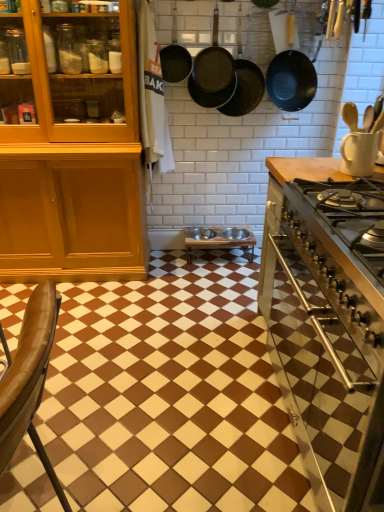
What do you see at coordinates (175, 56) in the screenshot? Image resolution: width=384 pixels, height=512 pixels. I see `matte black frying pan at upper center, arranged as the first frying pan when viewed from the left` at bounding box center [175, 56].

What is the approximate width of black matte frying pan at upper center, which is the first frying pan in right-to-left order?

black matte frying pan at upper center, which is the first frying pan in right-to-left order, is 7.88 inches in width.

I want to click on brown glossy tile at center, so click(x=169, y=394).

You are a GUI agent. You are given a task and a screenshot of the screen. Output one action in this format:
    pyautogui.click(x=<x>, y=<y>)
    Task: Click on the dark brown matte frying pan at upper center, acting as the 3th frying pan starting from the left
    The image size is (384, 512).
    Given the screenshot: What is the action you would take?
    pyautogui.click(x=245, y=89)

Locate an element on the screen. black cast iron frying pan at upper center, which appears as the 3th frying pan when viewed from the right is located at coordinates (213, 73).

Are dark brown matte frying pan at upper center, acting as the 3th frying pan starting from the left, and brown leather chair at lower left located far from each other?

Yes.

Is dark brown matte frying pan at upper center, acting as the 3th frying pan starting from the left, turned away from brown leather chair at lower left?

No, brown leather chair at lower left is not at the back of dark brown matte frying pan at upper center, acting as the 3th frying pan starting from the left.

From the image's perspective, who appears lower, dark brown matte frying pan at upper center, which is the second frying pan in right-to-left order, or brown leather chair at lower left?

From the image's view, brown leather chair at lower left is below.

Which point is more distant from viewer, [252,86] or [25,380]?

Positioned behind is point [252,86].

Considering the sizes of objects black cast iron frying pan at upper center, the 2th frying pan viewed from the left, and wooden table at center in the image provided, who is wider, black cast iron frying pan at upper center, the 2th frying pan viewed from the left, or wooden table at center?

With larger width is wooden table at center.

Looking at this image, from a real-world perspective, relative to wooden table at center, is black cast iron frying pan at upper center, which appears as the 3th frying pan when viewed from the right, vertically above or below?

black cast iron frying pan at upper center, which appears as the 3th frying pan when viewed from the right, is situated higher than wooden table at center in the real world.

Is black cast iron frying pan at upper center, which appears as the 3th frying pan when viewed from the right, positioned before wooden table at center?

Yes, the depth of black cast iron frying pan at upper center, which appears as the 3th frying pan when viewed from the right, is less than that of wooden table at center.

You are a GUI agent. You are given a task and a screenshot of the screen. Output one action in this format:
    pyautogui.click(x=<x>, y=<y>)
    Task: Click on the table on the right of black cast iron frying pan at upper center, the 2th frying pan viewed from the left
    This screenshot has width=384, height=512.
    Given the screenshot: What is the action you would take?
    pyautogui.click(x=220, y=239)

Which frying pan is the 4th one when counting from the back of the white matte mug at upper right? Please provide its 2D coordinates.

[(175, 56)]

Is white matte mug at upper right next to matte black frying pan at upper center, which ranks as the fourth frying pan in right-to-left order, and touching it?

No.

Between white matte mug at upper right and matte black frying pan at upper center, arranged as the first frying pan when viewed from the left, which one has larger size?

Bigger between the two is matte black frying pan at upper center, arranged as the first frying pan when viewed from the left.

Could you tell me if white matte mug at upper right is facing matte black frying pan at upper center, arranged as the first frying pan when viewed from the left?

No, white matte mug at upper right does not turn towards matte black frying pan at upper center, arranged as the first frying pan when viewed from the left.

Does point (351, 170) come in front of point (33, 332)?

No, it is behind (33, 332).

Would you say white matte mug at upper right is outside brown leather chair at lower left?

That's correct, white matte mug at upper right is outside of brown leather chair at lower left.

From the picture: Does white matte mug at upper right have a smaller size compared to brown leather chair at lower left?

Indeed, white matte mug at upper right has a smaller size compared to brown leather chair at lower left.

From the image's perspective, between black cast iron frying pan at upper center, which appears as the 3th frying pan when viewed from the right, and white matte mug at upper right, who is located below?

From the image's view, white matte mug at upper right is below.

Does black cast iron frying pan at upper center, which appears as the 3th frying pan when viewed from the right, have a greater height compared to white matte mug at upper right?

Yes.

In the scene shown: Is black cast iron frying pan at upper center, the 2th frying pan viewed from the left, to the left of white matte mug at upper right from the viewer's perspective?

Indeed, black cast iron frying pan at upper center, the 2th frying pan viewed from the left, is positioned on the left side of white matte mug at upper right.

Is white matte mug at upper right surrounded by black cast iron frying pan at upper center, the 2th frying pan viewed from the left?

No, white matte mug at upper right is not a part of black cast iron frying pan at upper center, the 2th frying pan viewed from the left.

Can you see matte black frying pan at upper center, arranged as the first frying pan when viewed from the left, touching black cast iron frying pan at upper center, which appears as the 3th frying pan when viewed from the right?

No, matte black frying pan at upper center, arranged as the first frying pan when viewed from the left, is not in contact with black cast iron frying pan at upper center, which appears as the 3th frying pan when viewed from the right.

Relative to black cast iron frying pan at upper center, the 2th frying pan viewed from the left, is matte black frying pan at upper center, which ranks as the fourth frying pan in right-to-left order, in front or behind?

matte black frying pan at upper center, which ranks as the fourth frying pan in right-to-left order, is behind black cast iron frying pan at upper center, the 2th frying pan viewed from the left.

Based on the photo, considering the positions of objects matte black frying pan at upper center, arranged as the first frying pan when viewed from the left, and black cast iron frying pan at upper center, which appears as the 3th frying pan when viewed from the right, in the image provided, who is more to the right, matte black frying pan at upper center, arranged as the first frying pan when viewed from the left, or black cast iron frying pan at upper center, which appears as the 3th frying pan when viewed from the right,?

From the viewer's perspective, black cast iron frying pan at upper center, which appears as the 3th frying pan when viewed from the right, appears more on the right side.

Could you tell me if matte black frying pan at upper center, arranged as the first frying pan when viewed from the left, is facing black cast iron frying pan at upper center, which appears as the 3th frying pan when viewed from the right?

No, matte black frying pan at upper center, arranged as the first frying pan when viewed from the left, is not facing towards black cast iron frying pan at upper center, which appears as the 3th frying pan when viewed from the right.

Could you tell me if metallic stainless steel stove at right is turned towards dark brown matte frying pan at upper center, which is the second frying pan in right-to-left order?

No, metallic stainless steel stove at right is not aimed at dark brown matte frying pan at upper center, which is the second frying pan in right-to-left order.

Which object is positioned more to the right, metallic stainless steel stove at right or dark brown matte frying pan at upper center, which is the second frying pan in right-to-left order?

metallic stainless steel stove at right is more to the right.

Based on the photo, is metallic stainless steel stove at right directly adjacent to dark brown matte frying pan at upper center, which is the second frying pan in right-to-left order?

No, metallic stainless steel stove at right is not in contact with dark brown matte frying pan at upper center, which is the second frying pan in right-to-left order.

Is metallic stainless steel stove at right shorter than dark brown matte frying pan at upper center, which is the second frying pan in right-to-left order?

No.

What are the coordinates of `the 1st frying pan behind when counting from the brown leather chair at lower left` in the screenshot? It's located at (245, 89).

Locate an element on the screen. The width and height of the screenshot is (384, 512). table that appears below the black cast iron frying pan at upper center, which appears as the 3th frying pan when viewed from the right (from the image's perspective) is located at coordinates (220, 239).

When comparing their distances from dark brown matte frying pan at upper center, acting as the 3th frying pan starting from the left, does brown glossy tile at center or metallic stainless steel stove at right seem further?

Among the two, brown glossy tile at center is located further to dark brown matte frying pan at upper center, acting as the 3th frying pan starting from the left.

From the image, which object appears to be nearer to black cast iron frying pan at upper center, the 2th frying pan viewed from the left, black matte frying pan at upper center, positioned as the 4th frying pan in left-to-right order, or matte black frying pan at upper center, arranged as the first frying pan when viewed from the left?

matte black frying pan at upper center, arranged as the first frying pan when viewed from the left.

Considering their positions, is black matte frying pan at upper center, positioned as the 4th frying pan in left-to-right order, positioned closer to white matte mug at upper right than wooden table at center?

Among the two, black matte frying pan at upper center, positioned as the 4th frying pan in left-to-right order, is located nearer to white matte mug at upper right.

From the image, which object appears to be farther from black matte frying pan at upper center, positioned as the 4th frying pan in left-to-right order, wooden table at center or brown glossy tile at center?

brown glossy tile at center.

When comparing their distances from metallic stainless steel stove at right, does dark brown matte frying pan at upper center, acting as the 3th frying pan starting from the left, or wooden table at center seem further?

wooden table at center lies further to metallic stainless steel stove at right than the other object.

Looking at this image, which object lies further to the anchor point metallic stainless steel stove at right, white matte mug at upper right or wooden table at center?

The object further to metallic stainless steel stove at right is wooden table at center.

Estimate the real-world distances between objects in this image. Which object is further from black matte frying pan at upper center, positioned as the 4th frying pan in left-to-right order, metallic stainless steel stove at right or matte black frying pan at upper center, arranged as the first frying pan when viewed from the left?

metallic stainless steel stove at right lies further to black matte frying pan at upper center, positioned as the 4th frying pan in left-to-right order, than the other object.

Which object lies further to the anchor point white matte mug at upper right, brown glossy tile at center or matte black frying pan at upper center, arranged as the first frying pan when viewed from the left?

matte black frying pan at upper center, arranged as the first frying pan when viewed from the left.

At what (x,y) coordinates should I click in order to perform the action: click on countertop between brown leather chair at lower left and black matte frying pan at upper center, positioned as the 4th frying pan in left-to-right order, from front to back. Please return your answer as a coordinate pair (x, y). Looking at the image, I should click on (328, 323).

This screenshot has height=512, width=384. Identify the location of kitchen appliance between brown glossy tile at center and wooden table at center along the z-axis. (359, 152).

The image size is (384, 512). What are the coordinates of `tile between brown leather chair at lower left and wooden table at center along the z-axis` in the screenshot? It's located at (169, 394).

At what (x,y) coordinates should I click in order to perform the action: click on kitchen appliance positioned between metallic stainless steel stove at right and wooden table at center from near to far. Please return your answer as a coordinate pair (x, y). This screenshot has width=384, height=512. Looking at the image, I should click on (359, 152).